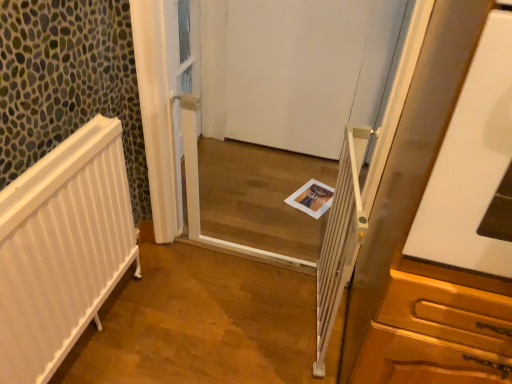
This screenshot has height=384, width=512. Identify the location of vacant space underneath white matte door at center (from a real-world perspective). (273, 146).